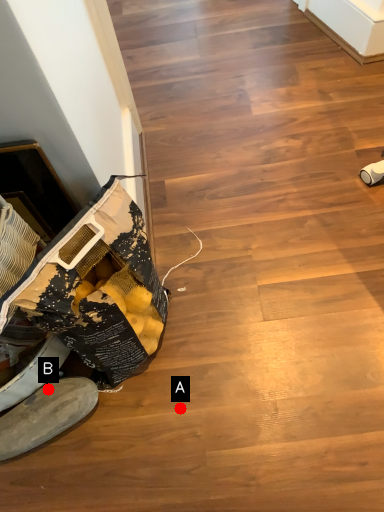
Question: Two points are circled on the image, labeled by A and B beside each circle. Which point is further to the camera?

Choices:
 (A) A is further
 (B) B is further

Answer: (A)